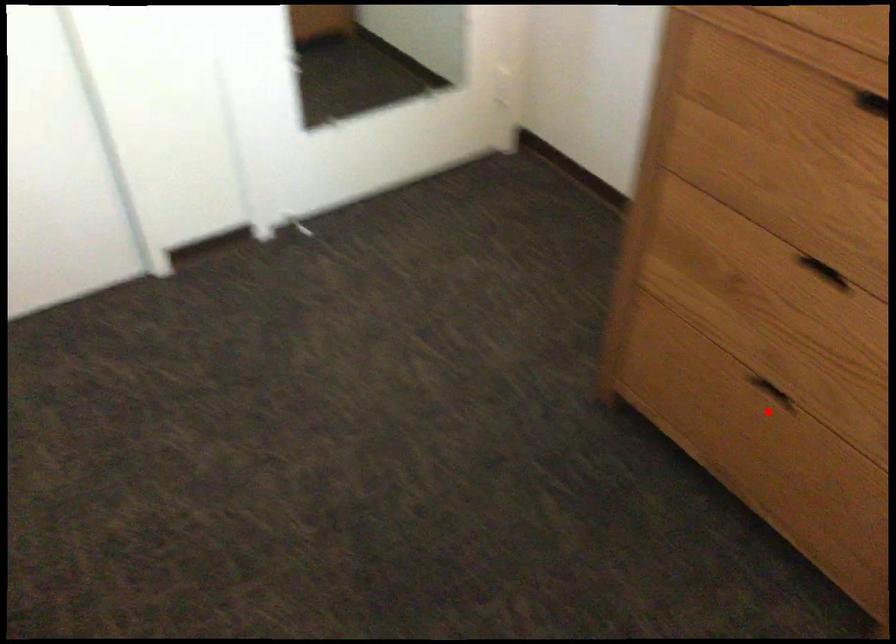
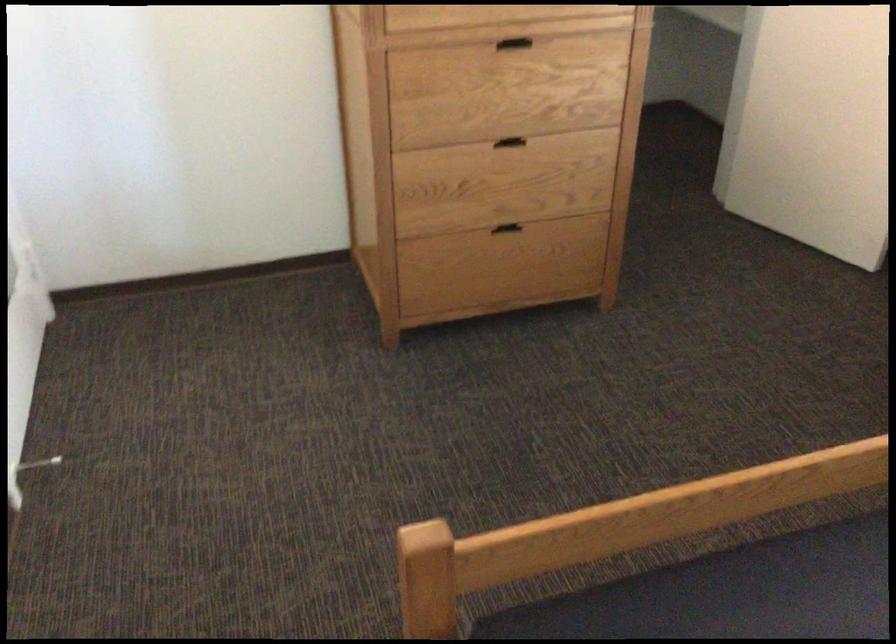
Question: I am providing you with two images of the same scene from different viewpoints. A red point is shown in image1. For the corresponding object point in image2, is it positioned nearer or farther from the camera?

Choices:
 (A) Nearer
 (B) Farther

Answer: (B)